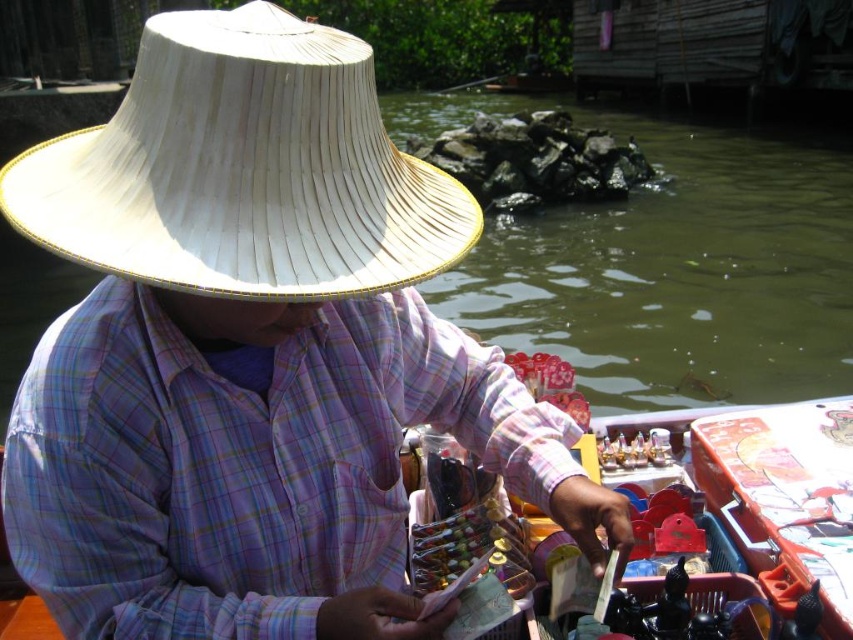
You are a traveler who wants to buy a souvenir. You see the plaid fabric at center and the white woven straw hat at upper center. Which item can you carry more easily due to its smaller size?

The white woven straw hat at upper center can be carried more easily due to its smaller size compared to the plaid fabric at center.

You are a customer at the market and want to know which item is higher between the plaid fabric at center and the white woven straw hat at upper center. Which one is taller?

The plaid fabric at center is taller than the white woven straw hat at upper center.

Where is the plaid fabric at center located in the image?

The plaid fabric at center is located at point [242,464] in the image.